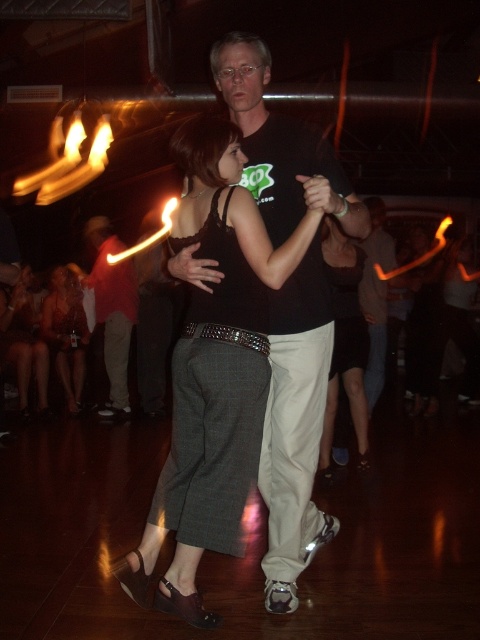
Can you confirm if matte black pants at center is taller than matte black shirt at center?

Indeed, matte black pants at center has a greater height compared to matte black shirt at center.

Does matte black pants at center have a smaller size compared to matte black shirt at center?

No.

This screenshot has width=480, height=640. In order to click on matte black pants at center in this screenshot , I will do `click(112, 308)`.

From the picture: How far apart are dark gray textured pants at center and matte black shirt at center?

A distance of 2.61 meters exists between dark gray textured pants at center and matte black shirt at center.

Who is shorter, dark gray textured pants at center or matte black shirt at center?

dark gray textured pants at center is shorter.

Who is more forward, (286, 252) or (372, 340)?

Point (286, 252) is more forward.

You are a GUI agent. You are given a task and a screenshot of the screen. Output one action in this format:
    pyautogui.click(x=<x>, y=<y>)
    Task: Click on the dark gray textured pants at center
    This screenshot has width=480, height=640.
    Given the screenshot: What is the action you would take?
    pyautogui.click(x=214, y=371)

Is dark gray textured pants at center wider than black leather pants at center?

Indeed, dark gray textured pants at center has a greater width compared to black leather pants at center.

Can you confirm if dark gray textured pants at center is positioned below black leather pants at center?

Indeed, dark gray textured pants at center is positioned under black leather pants at center.

Where is `dark gray textured pants at center`? Image resolution: width=480 pixels, height=640 pixels. dark gray textured pants at center is located at coordinates (214, 371).